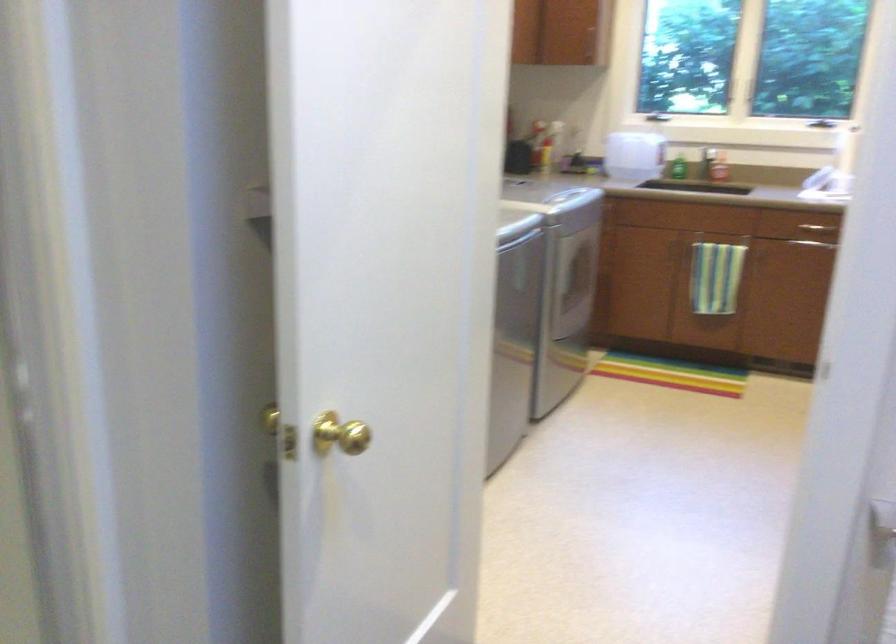
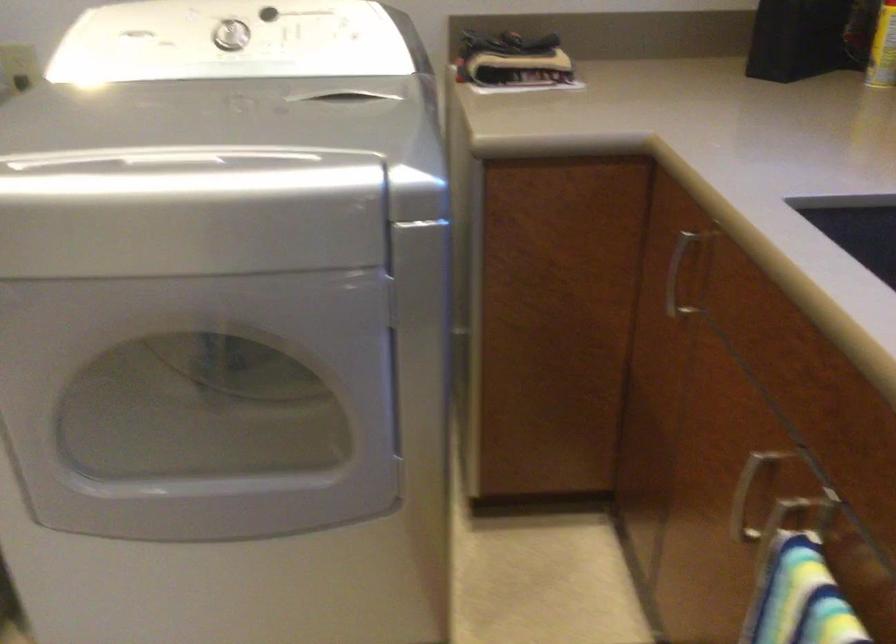
The point at (660, 254) is marked in the first image. Where is the corresponding point in the second image?

(745, 497)